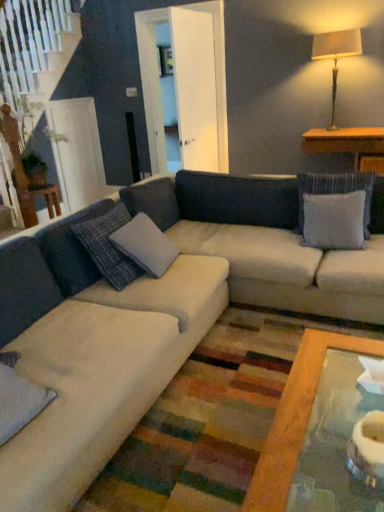
Question: Is gray fabric pillow at center, marked as the 2th pillow in a left-to-right arrangement, wider than wooden table at right?

Choices:
 (A) yes
 (B) no

Answer: (B)

Question: Is gray fabric pillow at center, which ranks as the 2th pillow in front-to-back order, positioned behind wooden table at right?

Choices:
 (A) yes
 (B) no

Answer: (B)

Question: Is gray fabric pillow at center, placed as the 2th pillow when sorted from right to left, at the left side of wooden table at right?

Choices:
 (A) yes
 (B) no

Answer: (A)

Question: Considering the relative sizes of gray fabric pillow at center, placed as the 2th pillow when sorted from right to left, and wooden table at right in the image provided, is gray fabric pillow at center, placed as the 2th pillow when sorted from right to left, bigger than wooden table at right?

Choices:
 (A) no
 (B) yes

Answer: (A)

Question: Is wooden table at right located within gray fabric pillow at center, placed as the 2th pillow when sorted from right to left?

Choices:
 (A) yes
 (B) no

Answer: (B)

Question: From a real-world perspective, is gray fabric pillow at center, marked as the 2th pillow in a left-to-right arrangement, positioned under wooden table at right based on gravity?

Choices:
 (A) yes
 (B) no

Answer: (A)

Question: Can you confirm if matte beige lampshade at upper right is thinner than gray fabric pillow at upper right, which ranks as the first pillow in right-to-left order?

Choices:
 (A) yes
 (B) no

Answer: (A)

Question: From a real-world perspective, is matte beige lampshade at upper right located beneath gray fabric pillow at upper right, which ranks as the first pillow in right-to-left order?

Choices:
 (A) yes
 (B) no

Answer: (B)

Question: Is there a large distance between matte beige lampshade at upper right and gray fabric pillow at upper right, which appears as the third pillow when viewed from the front?

Choices:
 (A) yes
 (B) no

Answer: (A)

Question: Does matte beige lampshade at upper right have a lesser height compared to gray fabric pillow at upper right, which ranks as the first pillow in right-to-left order?

Choices:
 (A) yes
 (B) no

Answer: (B)

Question: Is matte beige lampshade at upper right not within gray fabric pillow at upper right, which ranks as the first pillow in right-to-left order?

Choices:
 (A) yes
 (B) no

Answer: (A)

Question: From the image's perspective, is matte beige lampshade at upper right on gray fabric pillow at upper right, which ranks as the first pillow in right-to-left order?

Choices:
 (A) no
 (B) yes

Answer: (B)

Question: Can you confirm if matte beige lampshade at upper right is taller than velvety gray pillow at lower left, the 3th pillow from the right?

Choices:
 (A) yes
 (B) no

Answer: (A)